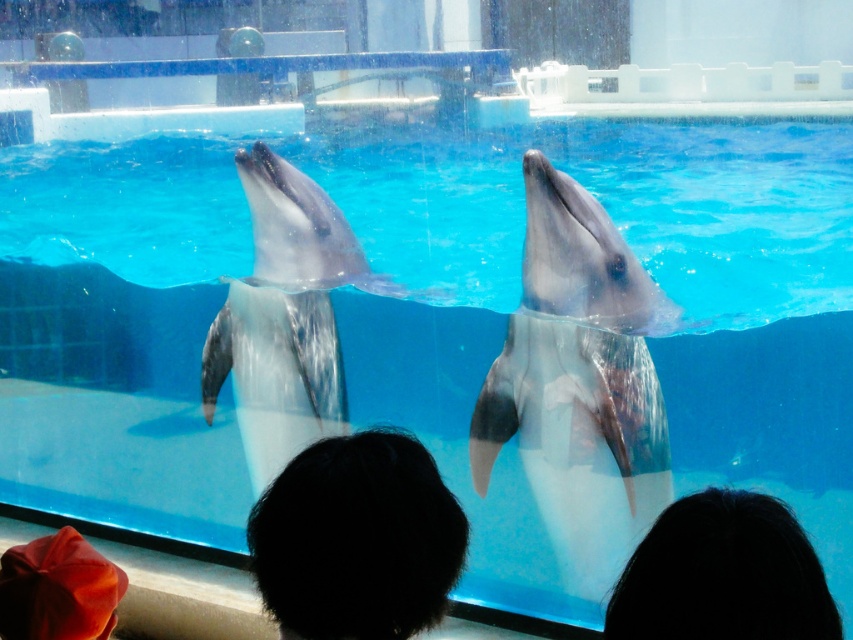
Between gray matte dolphin at center and smooth gray dolphin at center, which one has less height?

smooth gray dolphin at center

Which is below, gray matte dolphin at center or smooth gray dolphin at center?

gray matte dolphin at center

This screenshot has width=853, height=640. I want to click on gray matte dolphin at center, so click(579, 385).

I want to click on gray matte dolphin at center, so click(x=579, y=385).

Is point (543, 392) positioned in front of point (28, 589)?

No, (543, 392) is behind (28, 589).

Who is positioned more to the left, gray matte dolphin at center or smooth orange hat at lower left?

smooth orange hat at lower left is more to the left.

The image size is (853, 640). Describe the element at coordinates (579, 385) in the screenshot. I see `gray matte dolphin at center` at that location.

Locate an element on the screen. Image resolution: width=853 pixels, height=640 pixels. gray matte dolphin at center is located at coordinates (579, 385).

Can you confirm if gray matte dolphin at center is thinner than black hair at lower center?

No, gray matte dolphin at center is not thinner than black hair at lower center.

Looking at this image, can you confirm if gray matte dolphin at center is positioned to the left of black hair at lower center?

No, gray matte dolphin at center is not to the left of black hair at lower center.

Does point (529, 173) come in front of point (358, 433)?

No, it is not.

Find the location of a particular element. This screenshot has width=853, height=640. gray matte dolphin at center is located at coordinates (579, 385).